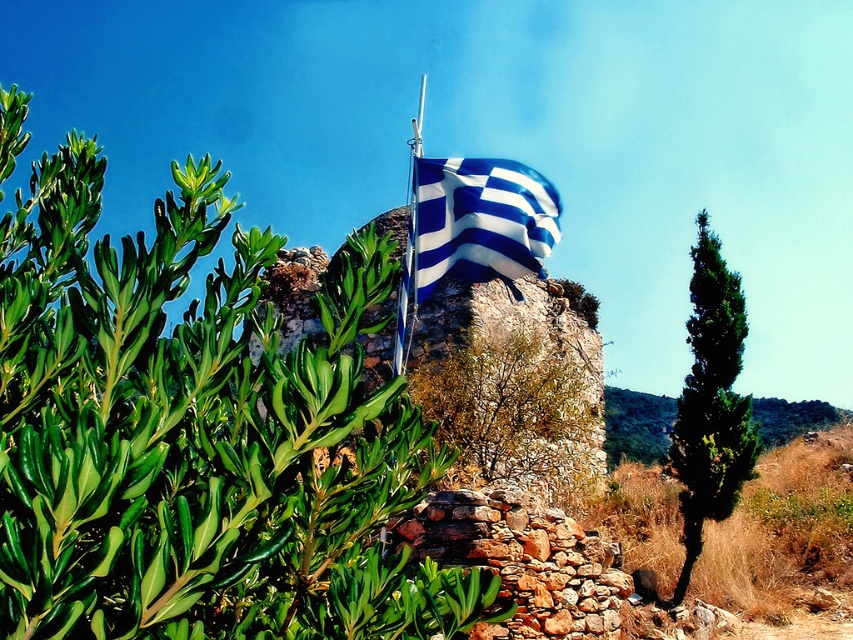
You are a bird looking for a perch. You see the green coniferous tree at right and the metallic flag pole at center. Which one is shorter and better for a small bird to land on?

The green coniferous tree at right is not as tall as the metallic flag pole at center, so it is shorter and better for a small bird to land on.

You are standing in the outdoor scene and want to reach the point at coordinates point (428, 225). If you walk straight ahead, will you reach that point before walking 20 meters?

The point (428, 225) is 17.15 meters from the viewer, so yes, you will reach it before walking 20 meters.

You are standing in the outdoor scene and want to take a photo of the metallic flag pole at center with the green coniferous tree at right in the background. Is the tree positioned to the right of the flag pole?

Yes, the green coniferous tree at right is to the right of the metallic flag pole at center, so it will be in the background if you position the flag pole towards the left side of your frame.